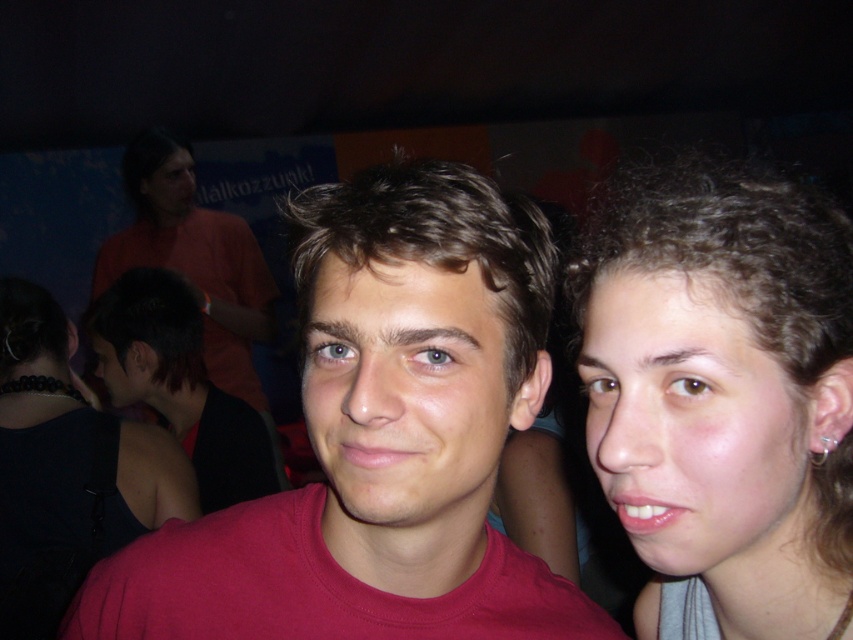
Who is higher up, matte red t-shirt at center or black leather dress at lower left?

matte red t-shirt at center is above.

Is point (367, 589) in front of point (9, 396)?

Yes, it is.

In order to click on matte red t-shirt at center in this screenshot , I will do tap(380, 438).

Does smooth skin face at right lie in front of matte red shirt at center?

That is False.

Based on the photo, who is higher up, smooth skin face at right or matte red shirt at center?

matte red shirt at center is higher up.

Is point (756, 435) in front of point (428, 502)?

Yes, it is.

Find the location of a particular element. This screenshot has height=640, width=853. smooth skin face at right is located at coordinates pyautogui.click(x=697, y=429).

Who is more forward, (456, 444) or (67, 531)?

Positioned in front is point (456, 444).

Is matte red shirt at center above black leather dress at lower left?

Correct, matte red shirt at center is located above black leather dress at lower left.

You are a GUI agent. You are given a task and a screenshot of the screen. Output one action in this format:
    pyautogui.click(x=<x>, y=<y>)
    Task: Click on the matte red shirt at center
    
    Given the screenshot: What is the action you would take?
    pyautogui.click(x=405, y=396)